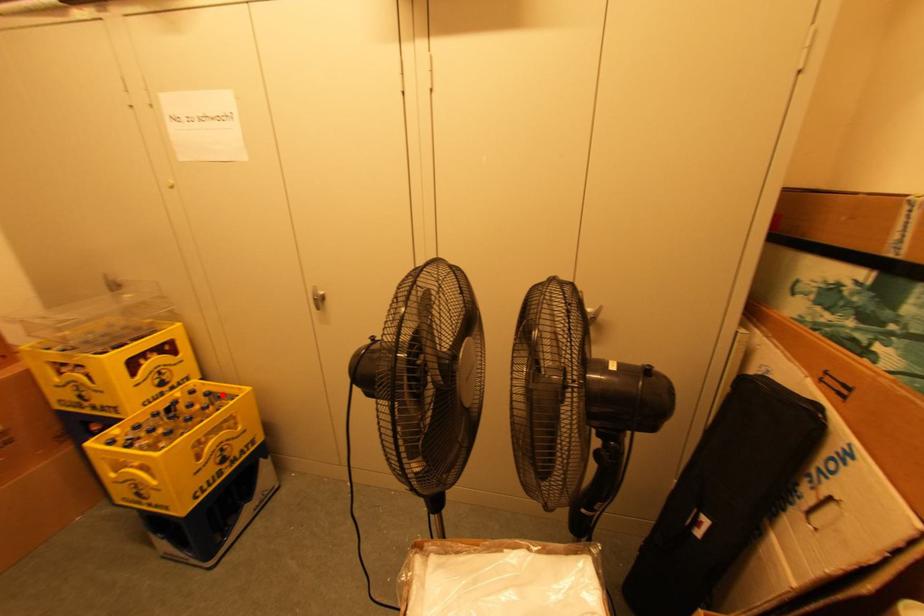
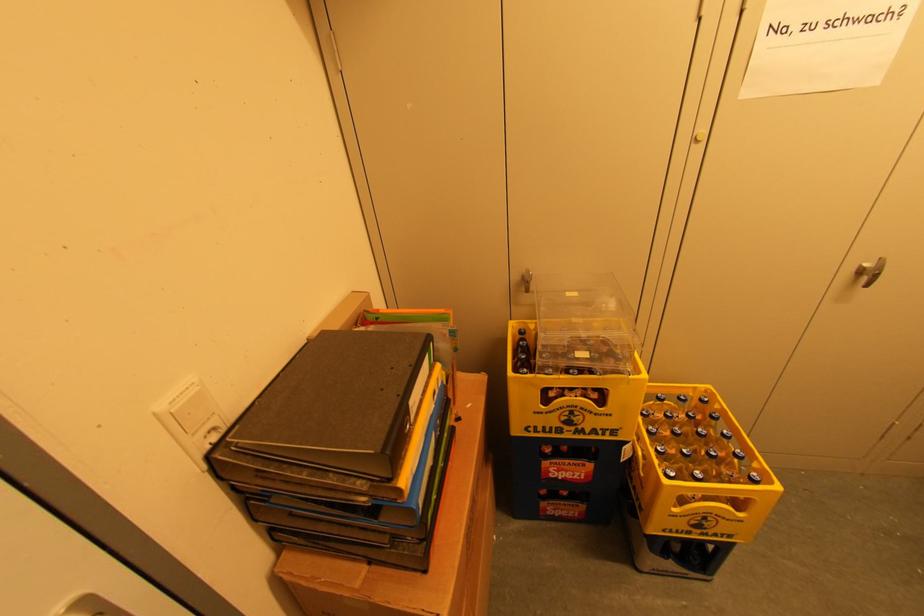
Locate, in the second image, the point that corresponds to the highlighted location in the first image.

(686, 398)